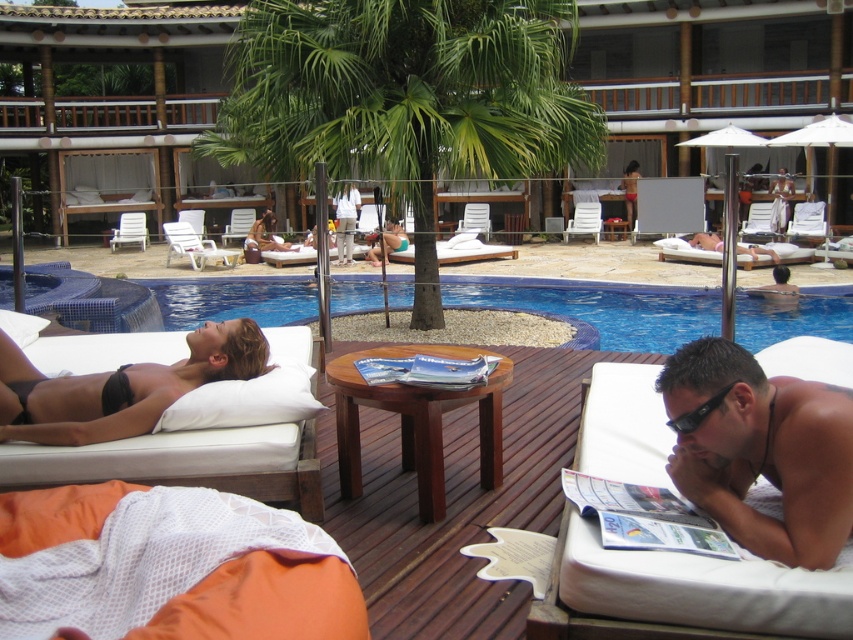
You are a delivery robot that needs to place a 3.5 feet wide package between the shiny black sunglasses at lower right and the matte paper magazine at center. Can you fit it there?

The shiny black sunglasses at lower right and matte paper magazine at center are 4.61 feet apart from each other. Since the package is 3.5 feet wide, which is less than the distance between them, the robot can fit the package between the shiny black sunglasses at lower right and the matte paper magazine at center.

You are a photographer taking a picture of the shiny black sunglasses at lower right and the matte paper magazine at center. Which object should you focus on first if you want to capture both in focus without moving the camera?

You should focus on the matte paper magazine at center first because the shiny black sunglasses at lower right is below it, so adjusting focus for the magazine will ensure both are in focus.